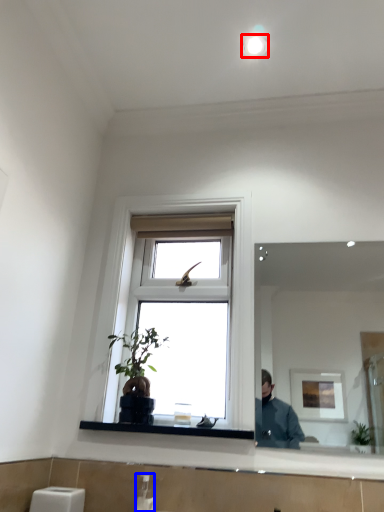
Question: Which object appears farthest to the camera in this image, light fixture (highlighted by a red box) or soap dispenser (highlighted by a blue box)?

Choices:
 (A) light fixture
 (B) soap dispenser

Answer: (A)